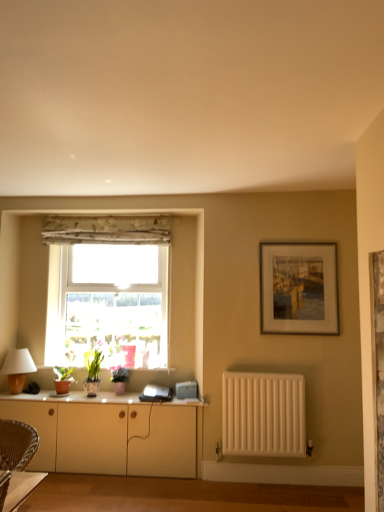
Find the location of a particular element. The image size is (384, 512). matte brown table lamp at left is located at coordinates (17, 368).

Identify the location of white matte radiator at lower right. This screenshot has width=384, height=512. (263, 414).

Locate an element on the screen. This screenshot has width=384, height=512. white matte cabinet at lower center is located at coordinates (112, 435).

Is white matte radiator at lower right inside wooden framed painting at upper right?

No, white matte radiator at lower right is not a part of wooden framed painting at upper right.

Is wooden framed painting at upper right taller than white matte radiator at lower right?

Indeed, wooden framed painting at upper right has a greater height compared to white matte radiator at lower right.

Locate an element on the screen. This screenshot has height=512, width=384. picture frame located behind the white matte radiator at lower right is located at coordinates (298, 288).

Is wooden framed painting at upper right thinner than white matte radiator at lower right?

Yes, wooden framed painting at upper right is thinner than white matte radiator at lower right.

Is point (158, 337) closer or farther from the camera than point (98, 415)?

Clearly, point (158, 337) is more distant from the camera than point (98, 415).

Does transparent glass window at center turn towards white matte cabinet at lower center?

No, transparent glass window at center is not facing towards white matte cabinet at lower center.

Identify the location of cabinetry on the left of transparent glass window at center. The width and height of the screenshot is (384, 512). click(112, 435).

Looking at the image, does transparent glass window at center seem bigger or smaller compared to white matte cabinet at lower center?

In the image, transparent glass window at center appears to be larger than white matte cabinet at lower center.

Does wooden framed painting at upper right turn towards white matte cabinet at lower center?

No, wooden framed painting at upper right is not aimed at white matte cabinet at lower center.

From a real-world perspective, is wooden framed painting at upper right physically located above or below white matte cabinet at lower center?

From a real-world perspective, wooden framed painting at upper right is physically above white matte cabinet at lower center.

Between wooden framed painting at upper right and white matte cabinet at lower center, which one appears on the left side from the viewer's perspective?

white matte cabinet at lower center is more to the left.

Is white matte cabinet at lower center to the left or to the right of white glossy cabinet at lower center in the image?

Clearly, white matte cabinet at lower center is on the left of white glossy cabinet at lower center in the image.

Does white matte cabinet at lower center turn towards white glossy cabinet at lower center?

No, white matte cabinet at lower center is not turned towards white glossy cabinet at lower center.

At what (x,y) coordinates should I click in order to perform the action: click on cabinetry in front of the white glossy cabinet at lower center. Please return your answer as a coordinate pair (x, y). The image size is (384, 512). Looking at the image, I should click on (112, 435).

From the image's perspective, who appears lower, matte brown table lamp at left or white matte cabinet at lower center?

white matte cabinet at lower center appears lower in the image.

Locate an element on the screen. Image resolution: width=384 pixels, height=512 pixels. table lamp above the white matte cabinet at lower center (from the image's perspective) is located at coordinates [x=17, y=368].

Is transparent glass window at center not within satin white laptop at center?

Indeed, transparent glass window at center is completely outside satin white laptop at center.

Who is more distant, transparent glass window at center or satin white laptop at center?

transparent glass window at center is behind.

Considering the relative positions of transparent glass window at center and satin white laptop at center in the image provided, is transparent glass window at center to the left of satin white laptop at center from the viewer's perspective?

Indeed, transparent glass window at center is positioned on the left side of satin white laptop at center.

Is transparent glass window at center beside satin white laptop at center?

No, transparent glass window at center is not next to satin white laptop at center.

Considering the relative positions of wooden framed painting at upper right and floral fabric curtain at upper center in the image provided, is wooden framed painting at upper right to the right of floral fabric curtain at upper center from the viewer's perspective?

Yes.

Is wooden framed painting at upper right positioned with its back to floral fabric curtain at upper center?

No, wooden framed painting at upper right is not facing the opposite direction of floral fabric curtain at upper center.

Choose the correct answer: Is wooden framed painting at upper right inside floral fabric curtain at upper center or outside it?

wooden framed painting at upper right cannot be found inside floral fabric curtain at upper center.

Which is closer, (321, 261) or (127, 218)?

The point (321, 261) is closer.

Locate an element on the screen. The width and height of the screenshot is (384, 512). picture frame above the white matte radiator at lower right (from the image's perspective) is located at coordinates (298, 288).

This screenshot has width=384, height=512. I want to click on cabinetry on the left of the transparent glass window at center, so click(112, 435).

Based on their spatial positions, is matte brown table lamp at left or white matte radiator at lower right further from white glossy cabinet at lower center?

white matte radiator at lower right lies further to white glossy cabinet at lower center than the other object.

From the image, which object appears to be farther from white matte cabinet at lower center, satin white laptop at center or white matte radiator at lower right?

Based on the image, white matte radiator at lower right appears to be further to white matte cabinet at lower center.

When comparing their distances from transparent glass window at center, does white glossy cabinet at lower center or white matte radiator at lower right seem further?

white matte radiator at lower right is positioned further to the anchor transparent glass window at center.

Based on their spatial positions, is wooden framed painting at upper right or white matte cabinet at lower center further from floral fabric curtain at upper center?

white matte cabinet at lower center.

Estimate the real-world distances between objects in this image. Which object is further from white matte cabinet at lower center, white glossy cabinet at lower center or wooden framed painting at upper right?

wooden framed painting at upper right is further to white matte cabinet at lower center.

Considering their positions, is white matte cabinet at lower center positioned further to white glossy cabinet at lower center than wooden framed painting at upper right?

wooden framed painting at upper right is positioned further to the anchor white glossy cabinet at lower center.

Considering their positions, is satin white laptop at center positioned closer to floral fabric curtain at upper center than white glossy cabinet at lower center?

white glossy cabinet at lower center is closer to floral fabric curtain at upper center.

Considering their positions, is floral fabric curtain at upper center positioned further to white matte cabinet at lower center than wooden framed painting at upper right?

floral fabric curtain at upper center lies further to white matte cabinet at lower center than the other object.

Locate an element on the screen. The height and width of the screenshot is (512, 384). cabinetry located between matte brown table lamp at left and white glossy cabinet at lower center in the left-right direction is located at coordinates (112, 435).

Locate an element on the screen. The height and width of the screenshot is (512, 384). window between floral fabric curtain at upper center and matte brown table lamp at left from top to bottom is located at coordinates (108, 290).

Locate an element on the screen. counter top between floral fabric curtain at upper center and white matte cabinet at lower center vertically is located at coordinates (74, 397).

Locate an element on the screen. radiator between floral fabric curtain at upper center and white matte cabinet at lower center from top to bottom is located at coordinates pos(263,414).